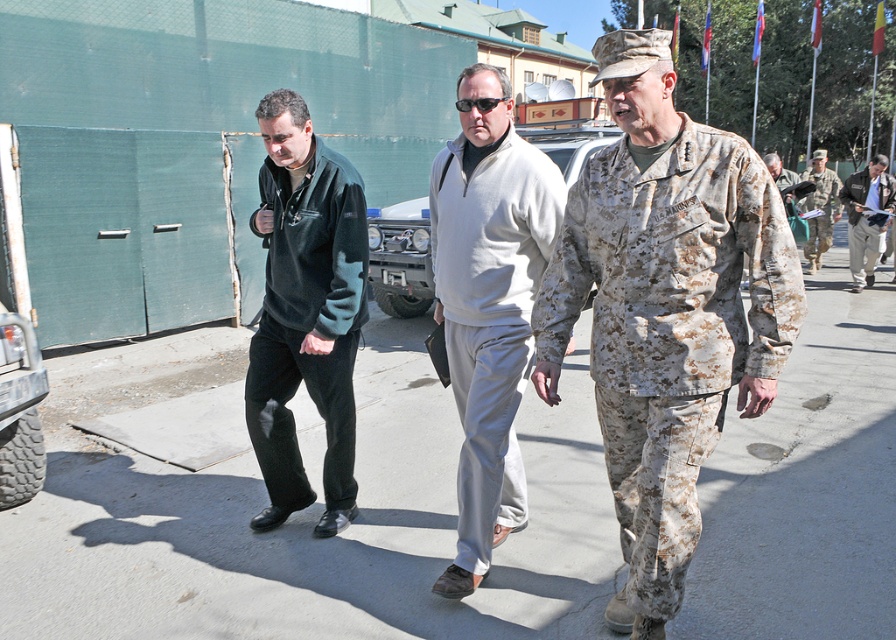
Based on the photo, you are a photographer positioned on the path. You want to capture a photo of the metallic silver jeep at center and the light gray fabric jacket at center in the same frame. Which object should you focus on first if you want both to be in focus without moving the camera?

You should focus on the light gray fabric jacket at center first since it is narrower than the metallic silver jeep at center, allowing both to be in focus within the frame.